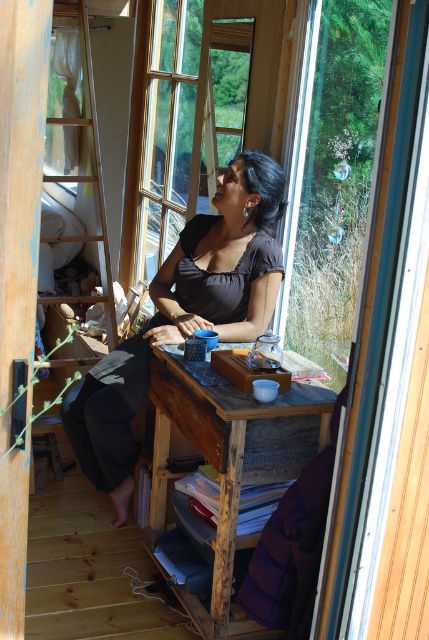
Is wooden table at center taller than wooden ladder at left?

Incorrect, wooden table at center's height is not larger of wooden ladder at left's.

Is point (169, 404) positioned in front of point (62, 243)?

Yes, point (169, 404) is in front of point (62, 243).

Identify the location of wooden table at center. [229, 461].

Which is more to the left, matte black shirt at center or wooden table at center?

From the viewer's perspective, matte black shirt at center appears more on the left side.

You are a GUI agent. You are given a task and a screenshot of the screen. Output one action in this format:
    pyautogui.click(x=<x>, y=<y>)
    Task: Click on the matte black shirt at center
    The image size is (429, 640).
    Given the screenshot: What is the action you would take?
    pyautogui.click(x=184, y=316)

Identify the location of matte black shirt at center. (184, 316).

Can you confirm if matte black shirt at center is bigger than wooden ladder at left?

No, matte black shirt at center is not bigger than wooden ladder at left.

Between matte black shirt at center and wooden ladder at left, which one appears on the right side from the viewer's perspective?

From the viewer's perspective, matte black shirt at center appears more on the right side.

Does point (81, 461) lie in front of point (45, 260)?

Yes.

The height and width of the screenshot is (640, 429). Find the location of `matte black shirt at center`. matte black shirt at center is located at coordinates tap(184, 316).